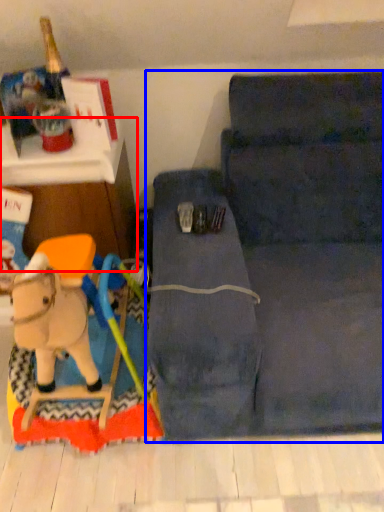
Question: Which of the following is the farthest to the observer, furniture (highlighted by a red box) or studio couch (highlighted by a blue box)?

Choices:
 (A) furniture
 (B) studio couch

Answer: (A)